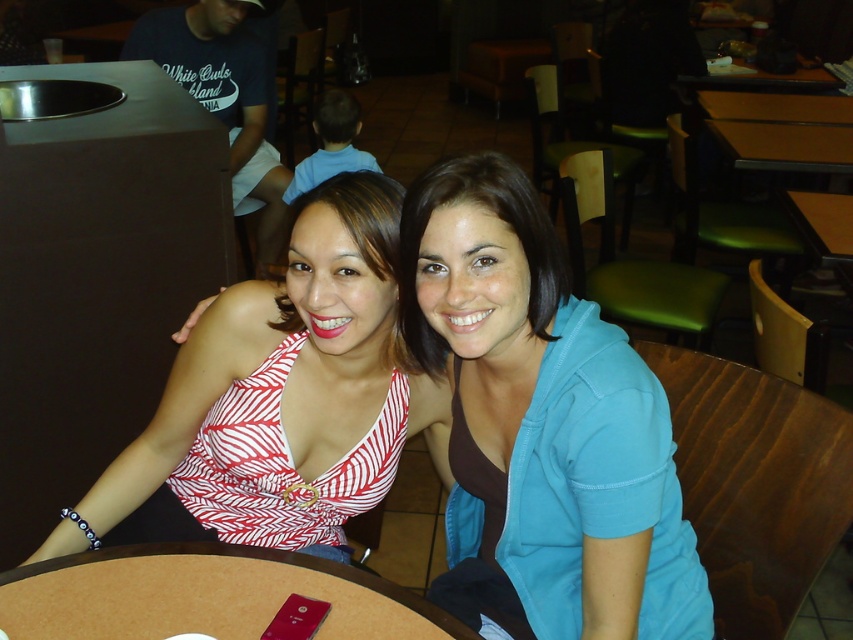
Is brown wood round table at center shorter than green plastic table at upper right?

Correct, brown wood round table at center is not as tall as green plastic table at upper right.

Does brown wood round table at center have a greater width compared to green plastic table at upper right?

No.

Does point (148, 588) lie in front of point (793, 93)?

Yes, point (148, 588) is in front of point (793, 93).

At what (x,y) coordinates should I click in order to perform the action: click on brown wood round table at center. Please return your answer as a coordinate pair (x, y). Looking at the image, I should click on (206, 595).

Who is positioned more to the right, striped fabric top at center or white and red striped tank top at center?

From the viewer's perspective, striped fabric top at center appears more on the right side.

Where is `striped fabric top at center`? The height and width of the screenshot is (640, 853). striped fabric top at center is located at coordinates (543, 426).

Who is higher up, brown wood round table at center or yellow matte table at upper right?

yellow matte table at upper right is higher up.

Is point (254, 595) more distant than point (711, 124)?

That is False.

Who is more distant from viewer, (378, 634) or (766, 129)?

The point (766, 129) is more distant.

The image size is (853, 640). I want to click on brown wood round table at center, so click(206, 595).